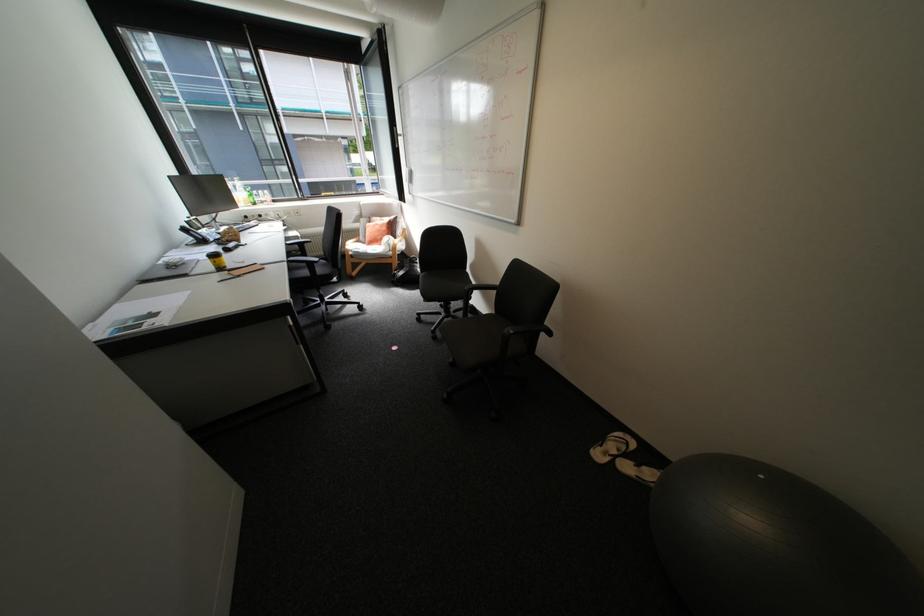
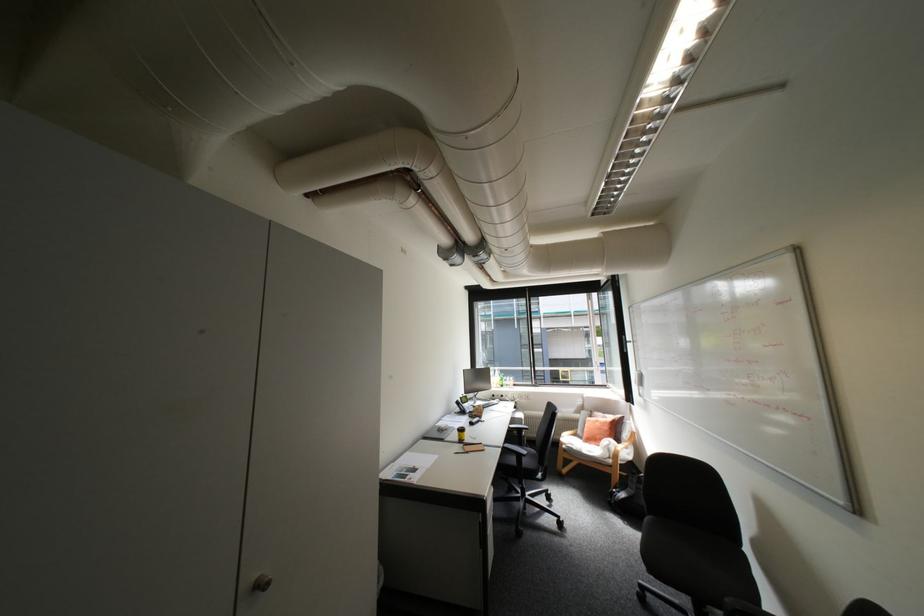
The images are taken continuously from a first-person perspective. In which direction is your viewpoint rotating?

The rotation direction of the camera is left-up.